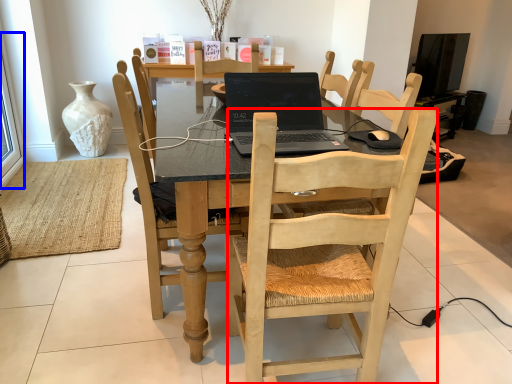
Question: Which object appears farthest to the camera in this image, chair (highlighted by a red box) or window screen (highlighted by a blue box)?

Choices:
 (A) chair
 (B) window screen

Answer: (B)